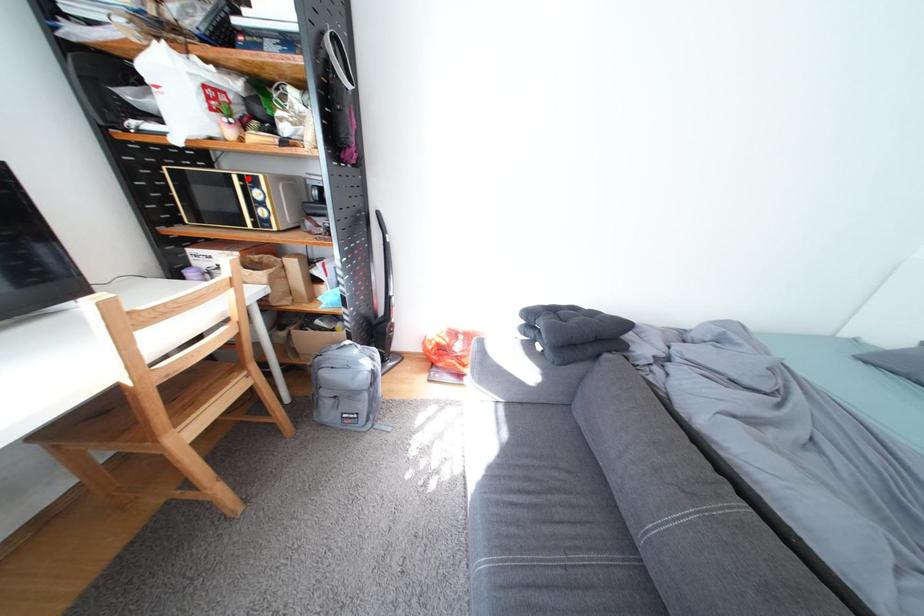
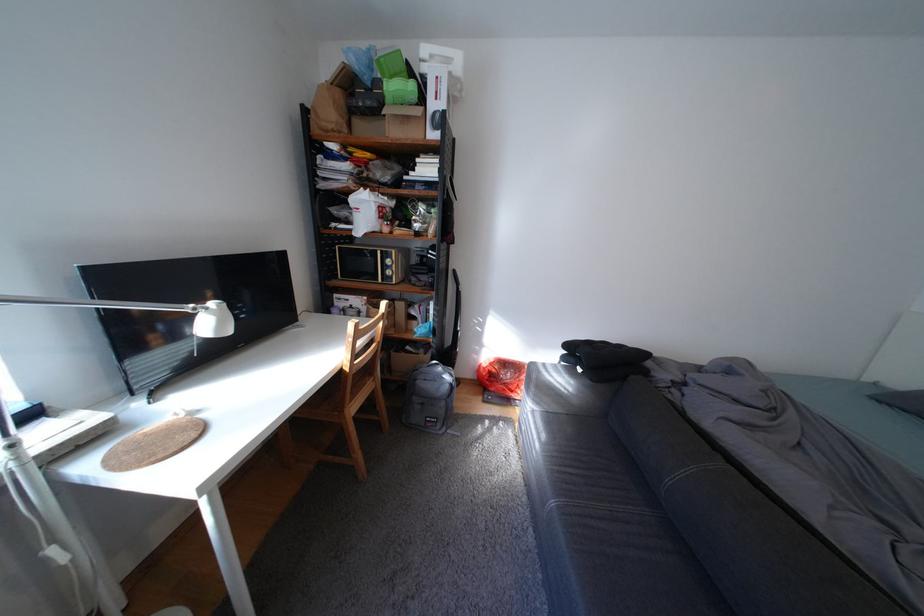
The point at the highlighted location is marked in the first image. Where is the corresponding point in the second image?

(392, 253)